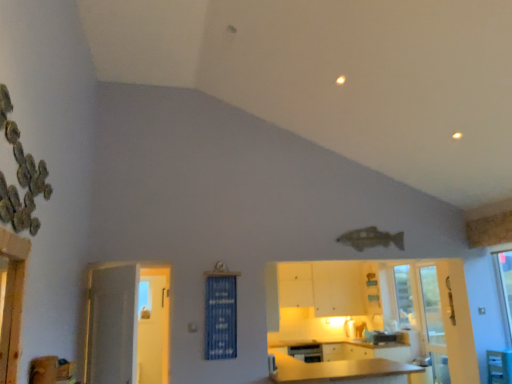
Question: Is clear glass screen door at lower right positioned behind white glossy door at left?

Choices:
 (A) no
 (B) yes

Answer: (B)

Question: From the image's perspective, is clear glass screen door at lower right located above white glossy door at left?

Choices:
 (A) yes
 (B) no

Answer: (B)

Question: Considering the relative sizes of clear glass screen door at lower right and white glossy door at left in the image provided, is clear glass screen door at lower right taller than white glossy door at left?

Choices:
 (A) yes
 (B) no

Answer: (A)

Question: Can you confirm if clear glass screen door at lower right is smaller than white glossy door at left?

Choices:
 (A) no
 (B) yes

Answer: (A)

Question: Is clear glass screen door at lower right next to white glossy door at left and touching it?

Choices:
 (A) no
 (B) yes

Answer: (A)

Question: From the image's perspective, is clear glass screen door at lower right above or below blue fabric curtain at center?

Choices:
 (A) below
 (B) above

Answer: (A)

Question: Does point (438, 369) appear closer or farther from the camera than point (208, 278)?

Choices:
 (A) closer
 (B) farther

Answer: (B)

Question: Considering the relative positions of clear glass screen door at lower right and blue fabric curtain at center in the image provided, is clear glass screen door at lower right to the left or to the right of blue fabric curtain at center?

Choices:
 (A) right
 (B) left

Answer: (A)

Question: Looking at their shapes, would you say clear glass screen door at lower right is wider or thinner than blue fabric curtain at center?

Choices:
 (A) wide
 (B) thin

Answer: (A)

Question: From a real-world perspective, is clear glass screen door at lower right positioned above or below white glossy door at left?

Choices:
 (A) above
 (B) below

Answer: (B)

Question: Looking at their shapes, would you say clear glass screen door at lower right is wider or thinner than white glossy door at left?

Choices:
 (A) thin
 (B) wide

Answer: (B)

Question: Is point (433, 291) positioned closer to the camera than point (92, 337)?

Choices:
 (A) farther
 (B) closer

Answer: (A)

Question: Based on their positions, is clear glass screen door at lower right located to the left or right of white glossy door at left?

Choices:
 (A) left
 (B) right

Answer: (B)

Question: From the image's perspective, is matte wood cabinetry at center, which is the first cabinetry from front to back, located above or below white glossy door at left?

Choices:
 (A) above
 (B) below

Answer: (B)

Question: Considering the positions of point (375, 369) and point (103, 322), is point (375, 369) closer or farther from the camera than point (103, 322)?

Choices:
 (A) closer
 (B) farther

Answer: (B)